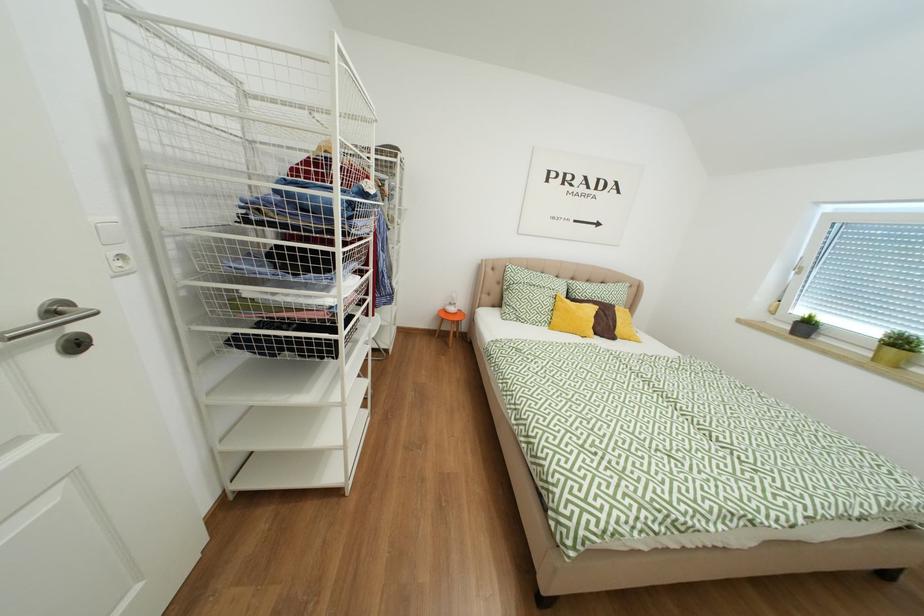
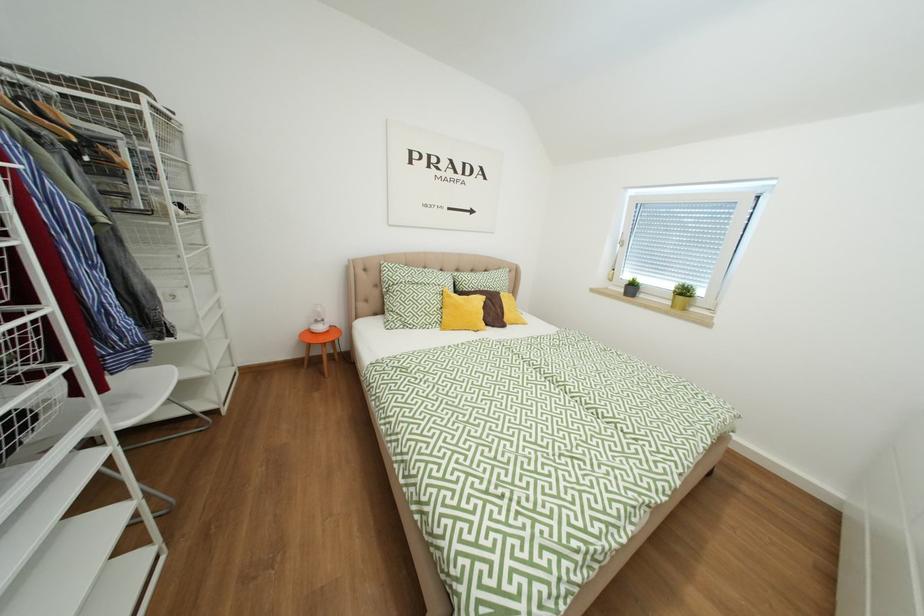
Question: The camera is either moving clockwise (left) or counter-clockwise (right) around the object. The first image is from the beginning of the video and the second image is from the end. Is the camera moving left or right when shooting the video?

Choices:
 (A) Left
 (B) Right

Answer: (A)